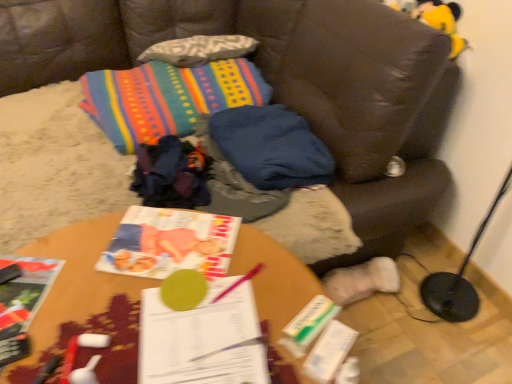
This screenshot has height=384, width=512. Find the location of `free point above white paper book at center, the 3th book positioned from the left (from a real-world perspective)`. free point above white paper book at center, the 3th book positioned from the left (from a real-world perspective) is located at coordinates (202, 332).